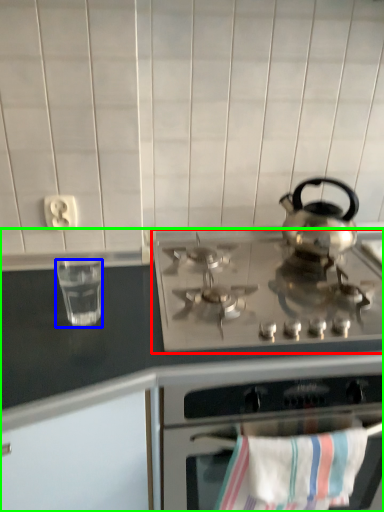
Question: Estimate the real-world distances between objects in this image. Which object is closer to gas stove (highlighted by a red box), appliance (highlighted by a blue box) or countertop (highlighted by a green box)?

Choices:
 (A) appliance
 (B) countertop

Answer: (B)